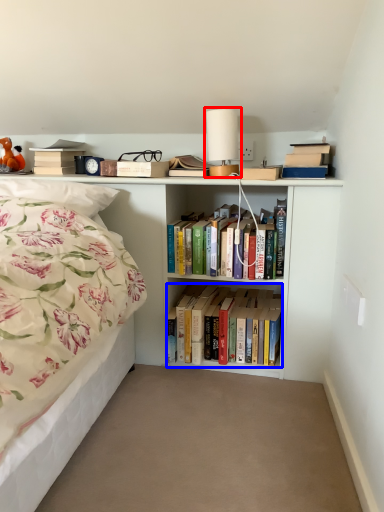
Question: Among these objects, which one is nearest to the camera, table lamp (highlighted by a red box) or book (highlighted by a blue box)?

Choices:
 (A) table lamp
 (B) book

Answer: (A)